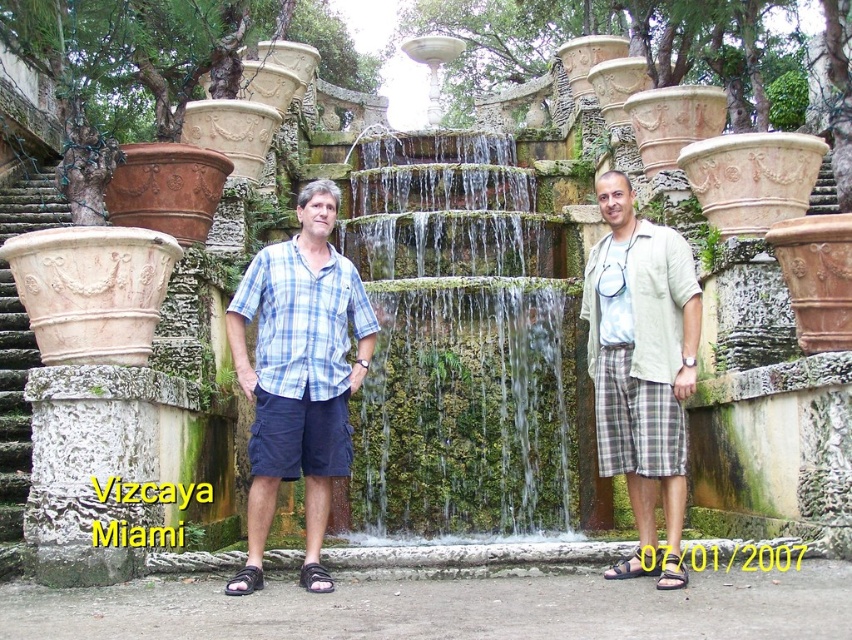
You are planning to take a photo of the green mossy stone waterfall at center and the blue plaid shirt at center. Which object should you focus on first if you want to capture both in the same frame without moving the camera?

The green mossy stone waterfall at center is wider than the blue plaid shirt at center, so you should focus on the green mossy stone waterfall at center first to ensure it fits entirely in the frame.

You are standing at the fountain area at Vizcaya, Miami. There are two points marked in the scene. Which point is closer to you, point [448,140] or point [648,417]?

Point [448,140] is closer to you because it is further to the viewer than point [648,417].

You are a photographer planning to capture a wide shot of the green mossy stone waterfall at center and the light beige cotton shirt at center. Based on their sizes, will the waterfall likely occupy more space in the photo than the shirt?

The green mossy stone waterfall at center might be wider than the light beige cotton shirt at center, so it is likely that the waterfall will occupy more space in the photo than the shirt.